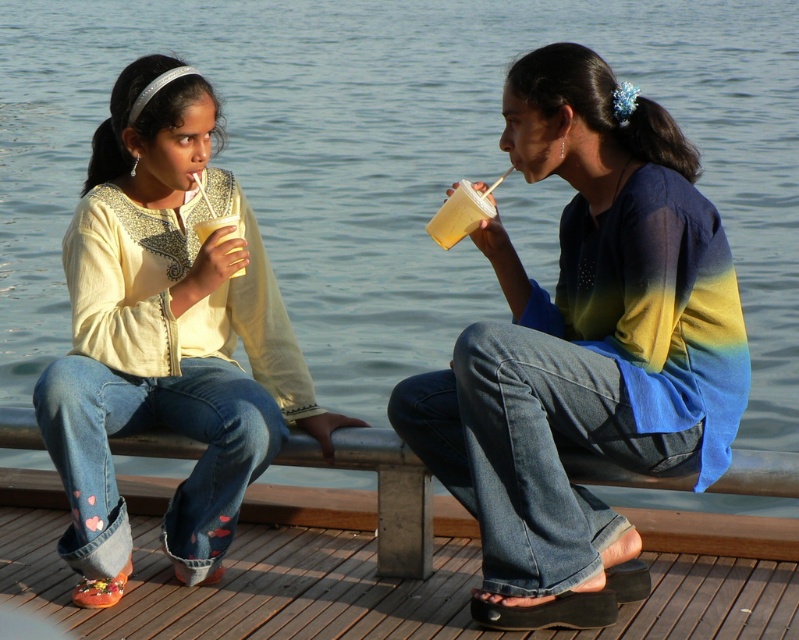
Image resolution: width=799 pixels, height=640 pixels. What do you see at coordinates (165, 336) in the screenshot?
I see `matte yellow shirt at left` at bounding box center [165, 336].

Does point (193, 570) lie in front of point (452, 195)?

Yes.

Locate an element on the screen. matte yellow shirt at left is located at coordinates (165, 336).

In the scene shown: Does matte yellow shirt at left appear over wooden dock at lower center?

Yes, matte yellow shirt at left is above wooden dock at lower center.

Can you confirm if matte yellow shirt at left is taller than wooden dock at lower center?

Indeed, matte yellow shirt at left has a greater height compared to wooden dock at lower center.

The height and width of the screenshot is (640, 799). What do you see at coordinates (165, 336) in the screenshot?
I see `matte yellow shirt at left` at bounding box center [165, 336].

Find the location of a particular element. The width and height of the screenshot is (799, 640). matte yellow shirt at left is located at coordinates (165, 336).

Who is taller, translucent plastic cup at center or translucent plastic cup at left?

Standing taller between the two is translucent plastic cup at left.

Identify the location of translucent plastic cup at center. (460, 214).

The image size is (799, 640). Find the location of `translucent plastic cup at center`. translucent plastic cup at center is located at coordinates (460, 214).